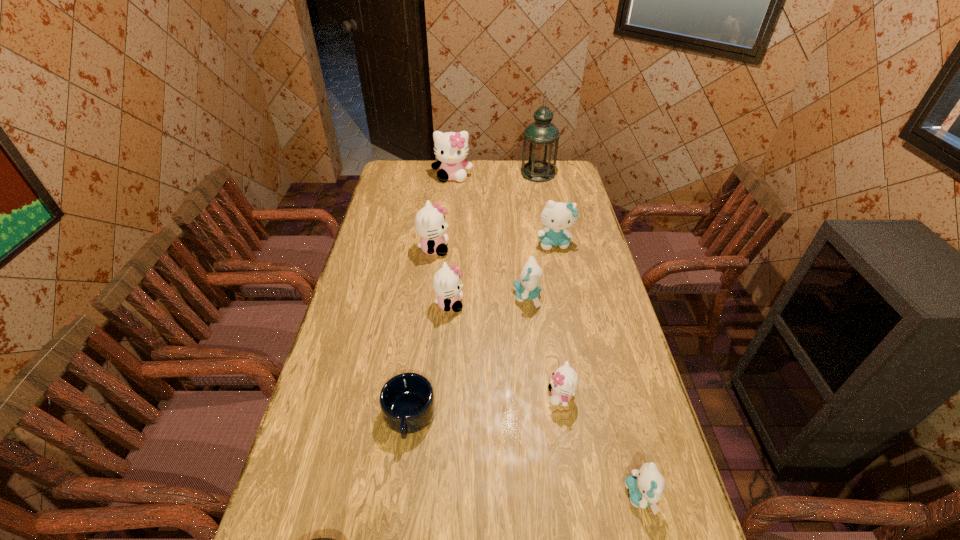
Locate an element on the screen. The width and height of the screenshot is (960, 540). oil lamp positioned at the far edge is located at coordinates (541, 138).

Find the location of a particular element. The image size is (960, 540). kitten that is positioned at the far edge is located at coordinates (451, 148).

This screenshot has width=960, height=540. Identify the location of oil lamp at the right edge. (541, 138).

Locate an element on the screen. This screenshot has height=540, width=960. object at the far right corner is located at coordinates (541, 138).

This screenshot has width=960, height=540. What are the coordinates of `vacant space at the far edge of the desktop` in the screenshot? It's located at (480, 170).

Find the location of `free spot at the left edge of the desktop`. free spot at the left edge of the desktop is located at coordinates (372, 222).

In the image, there is a desktop. What are the coordinates of `vacant space at the right edge` in the screenshot? It's located at (568, 185).

The image size is (960, 540). Identify the location of vacant space at the far left corner. (399, 183).

The height and width of the screenshot is (540, 960). In order to click on vacant space in between the tallest object and the nearest white kitten in this screenshot , I will do `click(549, 285)`.

This screenshot has width=960, height=540. What are the coordinates of `vacant area that lies between the green oil lamp and the second farthest white kitten` in the screenshot? It's located at (486, 211).